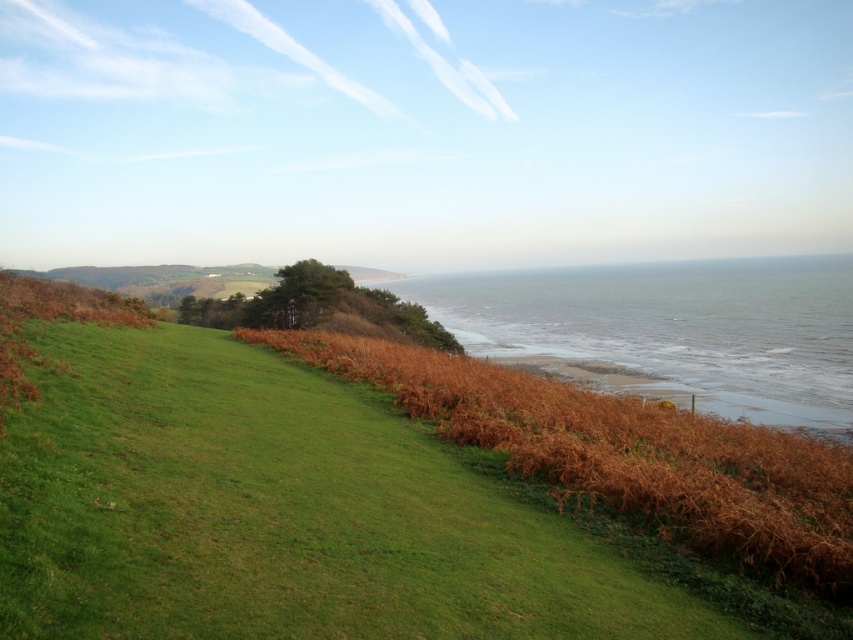
Question: Which point is closer to the camera taking this photo?

Choices:
 (A) (155, 410)
 (B) (486, 352)

Answer: (A)

Question: Is green grass at lower left above grayish-green water at lower center?

Choices:
 (A) yes
 (B) no

Answer: (B)

Question: Does green grass at lower left have a smaller size compared to grayish-green water at lower center?

Choices:
 (A) no
 (B) yes

Answer: (B)

Question: From the image, what is the correct spatial relationship of green grass at lower left in relation to grayish-green water at lower center?

Choices:
 (A) left
 (B) right

Answer: (A)

Question: Among these points, which one is nearest to the camera?

Choices:
 (A) (418, 280)
 (B) (520, 586)

Answer: (B)